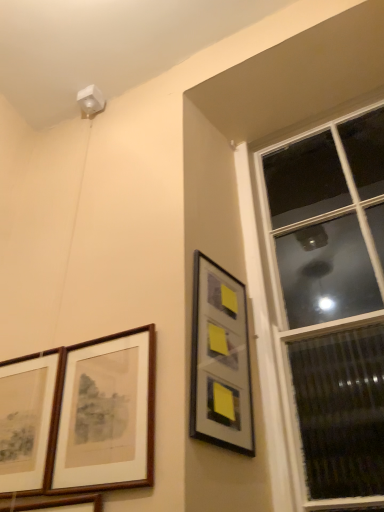
Question: Is brown wooden picture frame at lower left, the second picture frame positioned from the right, positioned in front of metallic silver picture frame at upper right, the 1th picture frame in the right-to-left sequence?

Choices:
 (A) no
 (B) yes

Answer: (B)

Question: Considering the relative positions of brown wooden picture frame at lower left, the third picture frame in the left-to-right sequence, and metallic silver picture frame at upper right, the 1th picture frame in the right-to-left sequence, in the image provided, is brown wooden picture frame at lower left, the third picture frame in the left-to-right sequence, to the left of metallic silver picture frame at upper right, the 1th picture frame in the right-to-left sequence, from the viewer's perspective?

Choices:
 (A) no
 (B) yes

Answer: (B)

Question: Can you confirm if brown wooden picture frame at lower left, the third picture frame in the left-to-right sequence, is thinner than metallic silver picture frame at upper right, the 1th picture frame in the right-to-left sequence?

Choices:
 (A) yes
 (B) no

Answer: (A)

Question: From a real-world perspective, is brown wooden picture frame at lower left, the second picture frame positioned from the right, located higher than metallic silver picture frame at upper right, the fourth picture frame from the left?

Choices:
 (A) no
 (B) yes

Answer: (A)

Question: Could you tell me if brown wooden picture frame at lower left, the third picture frame in the left-to-right sequence, is facing metallic silver picture frame at upper right, the fourth picture frame from the left?

Choices:
 (A) yes
 (B) no

Answer: (B)

Question: Is brown wooden picture frame at lower left, the third picture frame in the left-to-right sequence, beside metallic silver picture frame at upper right, the 1th picture frame in the right-to-left sequence?

Choices:
 (A) yes
 (B) no

Answer: (B)

Question: Can you see brown wooden picture frame at lower left, the second picture frame positioned from the right, touching wooden framed picture at lower left, placed as the 3th picture frame when sorted from right to left?

Choices:
 (A) no
 (B) yes

Answer: (A)

Question: From the image's perspective, is brown wooden picture frame at lower left, the second picture frame positioned from the right, under wooden framed picture at lower left, placed as the 3th picture frame when sorted from right to left?

Choices:
 (A) no
 (B) yes

Answer: (A)

Question: Considering the relative sizes of brown wooden picture frame at lower left, the second picture frame positioned from the right, and wooden framed picture at lower left, placed as the 3th picture frame when sorted from right to left, in the image provided, is brown wooden picture frame at lower left, the second picture frame positioned from the right, bigger than wooden framed picture at lower left, placed as the 3th picture frame when sorted from right to left,?

Choices:
 (A) no
 (B) yes

Answer: (A)

Question: From a real-world perspective, is brown wooden picture frame at lower left, the third picture frame in the left-to-right sequence, on wooden framed picture at lower left, placed as the 3th picture frame when sorted from right to left?

Choices:
 (A) yes
 (B) no

Answer: (A)

Question: Can you confirm if brown wooden picture frame at lower left, the second picture frame positioned from the right, is shorter than wooden framed picture at lower left, placed as the 3th picture frame when sorted from right to left?

Choices:
 (A) no
 (B) yes

Answer: (A)

Question: Does brown wooden picture frame at lower left, the third picture frame in the left-to-right sequence, lie in front of wooden framed picture at lower left, placed as the 3th picture frame when sorted from right to left?

Choices:
 (A) yes
 (B) no

Answer: (B)

Question: Is transparent glass window at upper right at the right side of wooden framed picture at lower left, placed as the 3th picture frame when sorted from right to left?

Choices:
 (A) no
 (B) yes

Answer: (B)